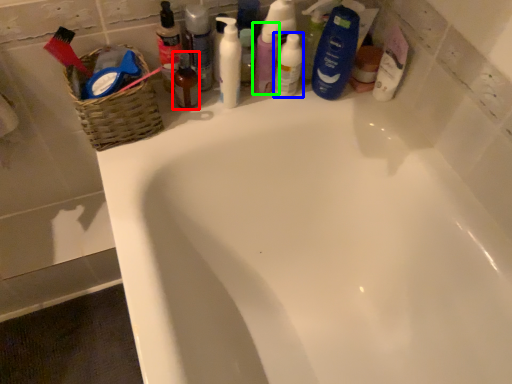
Question: Estimate the real-world distances between objects in this image. Which object is closer to toiletry (highlighted by a red box), mouthwash (highlighted by a blue box) or toiletry (highlighted by a green box)?

Choices:
 (A) mouthwash
 (B) toiletry

Answer: (B)